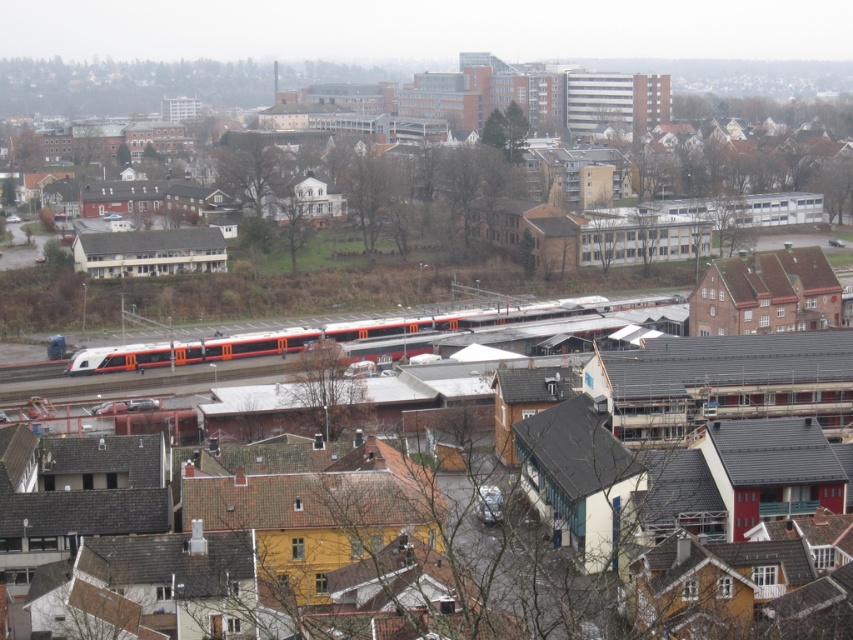
You are standing at the point marked as point (125, 84) in the image. What object is located at this point?

The point (125, 84) corresponds to the matte orange train at center.

You are a photographer planning to take a photo of the matte orange train at center and the orange metallic train at center from the same vantage point. Which train should you focus on first if you want to capture the tallest object in the scene?

The matte orange train at center has a greater height compared to the orange metallic train at center, so you should focus on the matte orange train at center first to capture the tallest object in the scene.